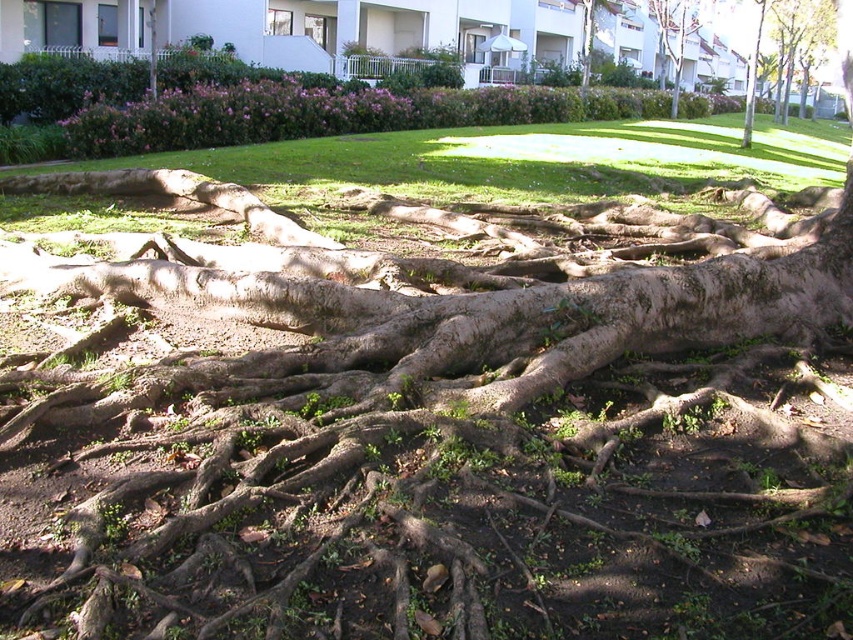
Can you confirm if green grass at center is thinner than green rough bark tree at upper center?

No.

What do you see at coordinates (524, 157) in the screenshot? I see `green grass at center` at bounding box center [524, 157].

Who is more distant from viewer, [486,134] or [596,3]?

The point [596,3] is more distant.

Locate an element on the screen. The image size is (853, 640). green grass at center is located at coordinates (524, 157).

Is green grass at center to the right of brown rough tree roots at upper right from the viewer's perspective?

No, green grass at center is not to the right of brown rough tree roots at upper right.

Who is positioned more to the right, green grass at center or brown rough tree roots at upper right?

Positioned to the right is brown rough tree roots at upper right.

Measure the distance between point (489, 180) and camera.

The distance of point (489, 180) from camera is 35.91 feet.

Find the location of a particular element. This screenshot has height=640, width=853. green grass at center is located at coordinates (524, 157).

Is brown rough tree at upper right smaller than green rough bark tree at upper center?

No, brown rough tree at upper right is not smaller than green rough bark tree at upper center.

Consider the image. Who is more forward, (752, 72) or (583, 28)?

Point (583, 28) is in front.

Image resolution: width=853 pixels, height=640 pixels. What are the coordinates of `brown rough tree at upper right` in the screenshot? It's located at (752, 74).